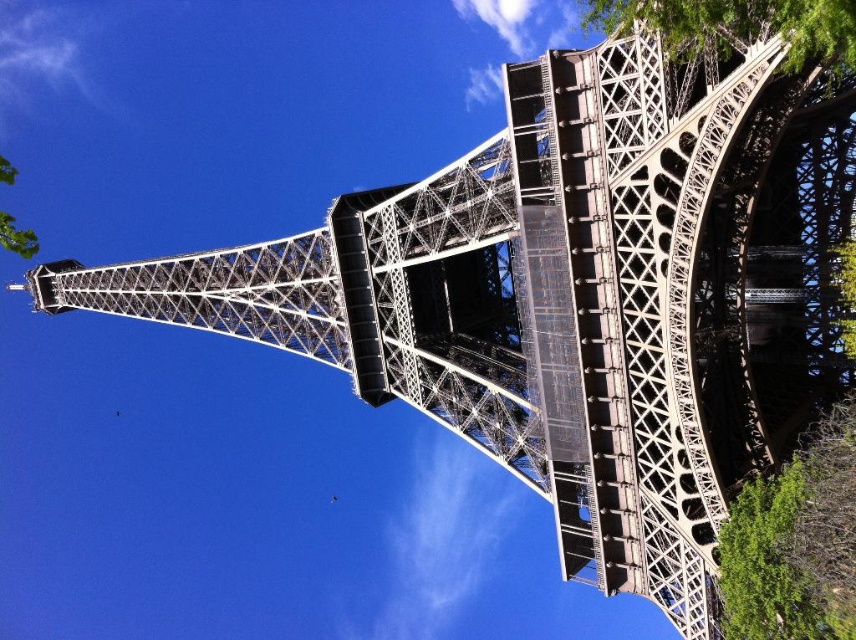
Who is shorter, green leafy tree at lower right or green leafy tree at upper right?

green leafy tree at lower right is shorter.

What do you see at coordinates (795, 541) in the screenshot? The width and height of the screenshot is (856, 640). I see `green leafy tree at lower right` at bounding box center [795, 541].

Locate an element on the screen. Image resolution: width=856 pixels, height=640 pixels. green leafy tree at lower right is located at coordinates (795, 541).

Is point (827, 468) more distant than point (0, 236)?

No, (827, 468) is in front of (0, 236).

Is green leafy tree at lower right to the right of green leafy tree at lower left from the viewer's perspective?

Correct, you'll find green leafy tree at lower right to the right of green leafy tree at lower left.

The image size is (856, 640). Describe the element at coordinates (795, 541) in the screenshot. I see `green leafy tree at lower right` at that location.

What are the coordinates of `green leafy tree at lower right` in the screenshot? It's located at (795, 541).

Which of these two, green leafy tree at upper right or green leafy tree at lower left, stands shorter?

Standing shorter between the two is green leafy tree at lower left.

Is green leafy tree at upper right thinner than green leafy tree at lower left?

Yes.

Measure the distance between green leafy tree at upper right and camera.

green leafy tree at upper right and camera are 42.36 meters apart.

Identify the location of green leafy tree at upper right. The height and width of the screenshot is (640, 856). (739, 28).